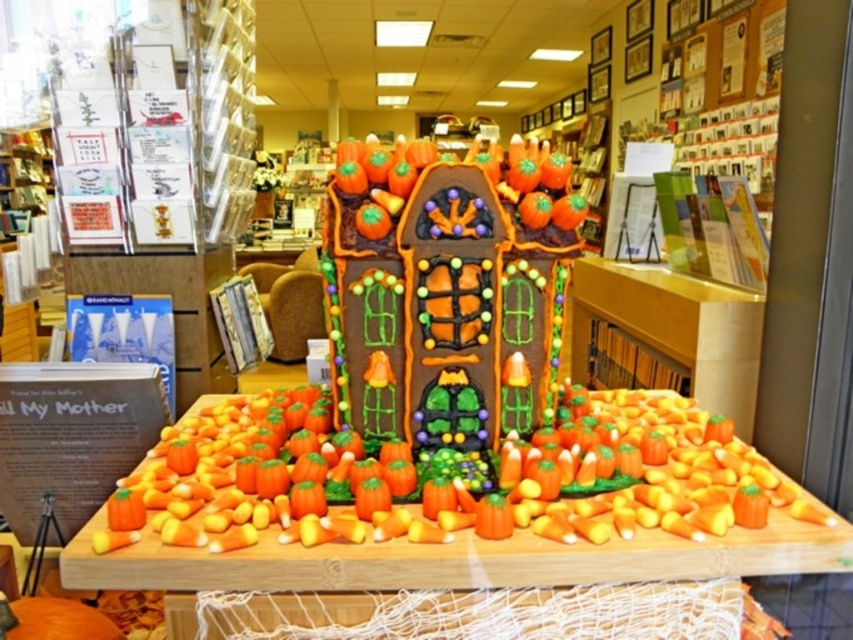
Find the location of a particular element. candy-coated pumpkin house at center is located at coordinates (440, 524).

Is candy-coated pumpkin house at center positioned behind orange matte pumpkin at center?

No, candy-coated pumpkin house at center is closer to the viewer.

Who is more distant from viewer, (708, 493) or (44, 618)?

The point (44, 618) is more distant.

This screenshot has width=853, height=640. I want to click on candy-coated pumpkin house at center, so click(440, 524).